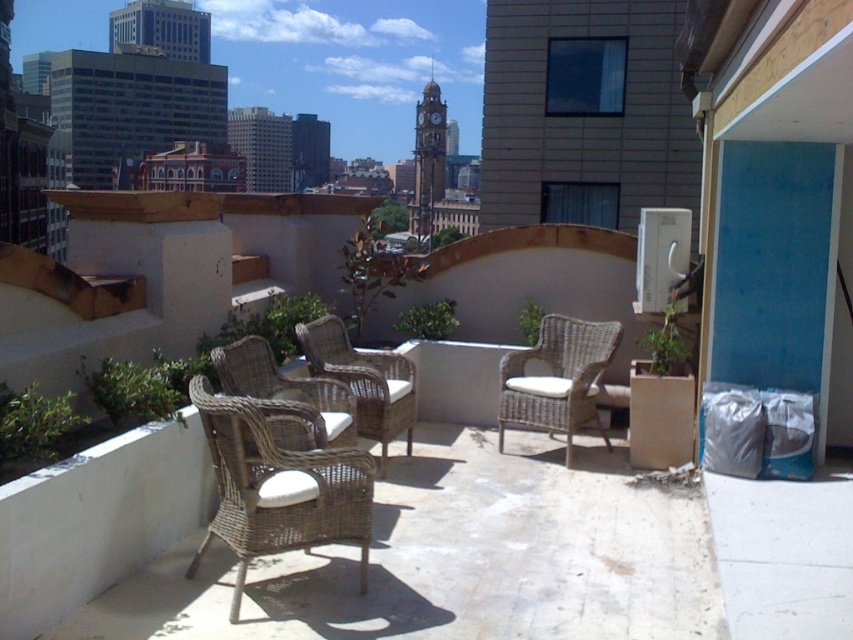
Is woven wicker armchair at center to the right of woven rattan chair at center from the viewer's perspective?

Incorrect, woven wicker armchair at center is not on the right side of woven rattan chair at center.

Does woven wicker armchair at center appear over woven rattan chair at center?

Incorrect, woven wicker armchair at center is not positioned above woven rattan chair at center.

Who is more forward, (296, 515) or (519, 397)?

Point (296, 515)

The height and width of the screenshot is (640, 853). I want to click on woven wicker armchair at center, so click(x=280, y=481).

Is woven wicker chair at center to the left of woven rattan armchair at center from the viewer's perspective?

No, woven wicker chair at center is not to the left of woven rattan armchair at center.

Can you confirm if woven wicker chair at center is wider than woven rattan armchair at center?

Yes, woven wicker chair at center is wider than woven rattan armchair at center.

Find the location of a particular element. This screenshot has height=640, width=853. woven wicker chair at center is located at coordinates (363, 380).

Locate an element on the screen. The width and height of the screenshot is (853, 640). woven wicker chair at center is located at coordinates (363, 380).

Between woven rattan chair at center and woven wicker chair at center, which one has more height?

woven rattan chair at center

Which is below, woven rattan chair at center or woven wicker chair at center?

Positioned lower is woven rattan chair at center.

Find the location of `woven rattan chair at center`. woven rattan chair at center is located at coordinates (556, 378).